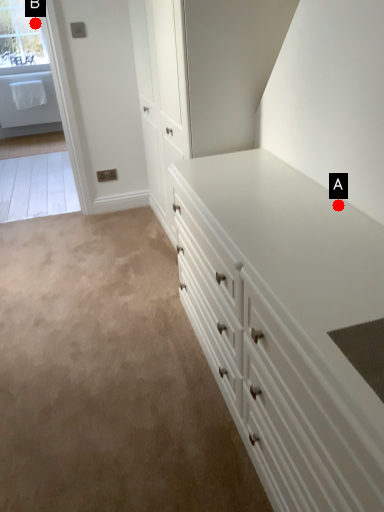
Question: Two points are circled on the image, labeled by A and B beside each circle. Among these points, which one is nearest to the camera?

Choices:
 (A) A is closer
 (B) B is closer

Answer: (A)